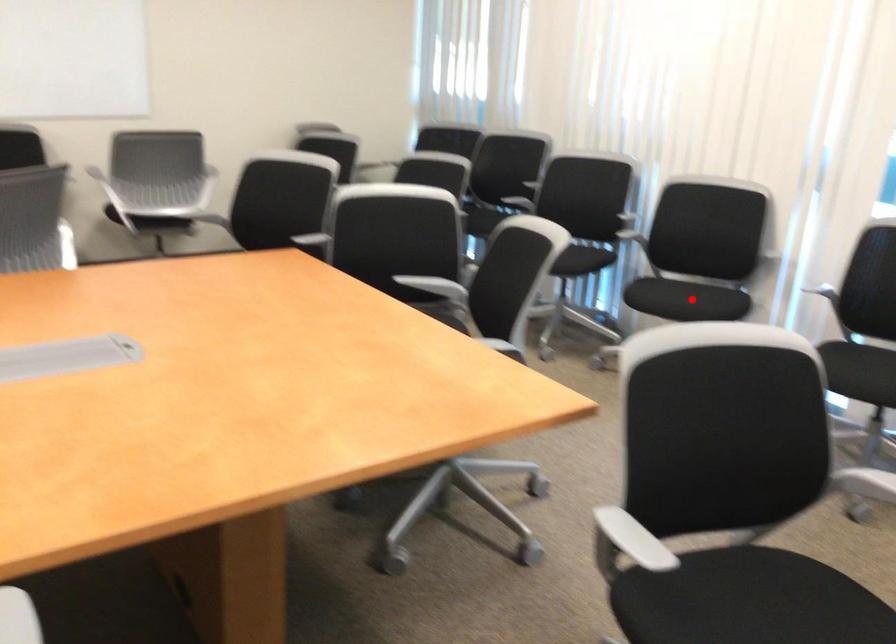
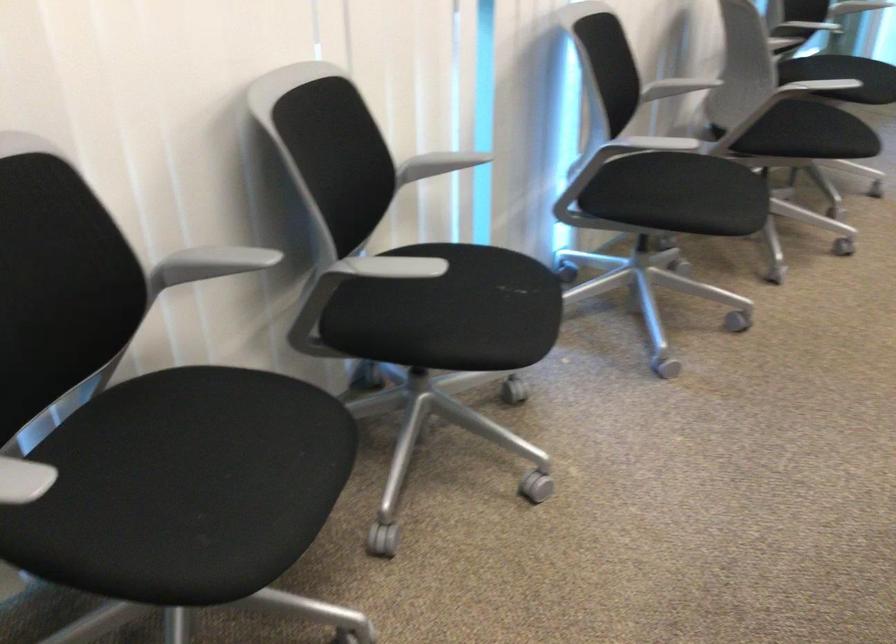
Where in the second image is the point corresponding to the highlighted location from the first image?

(515, 287)